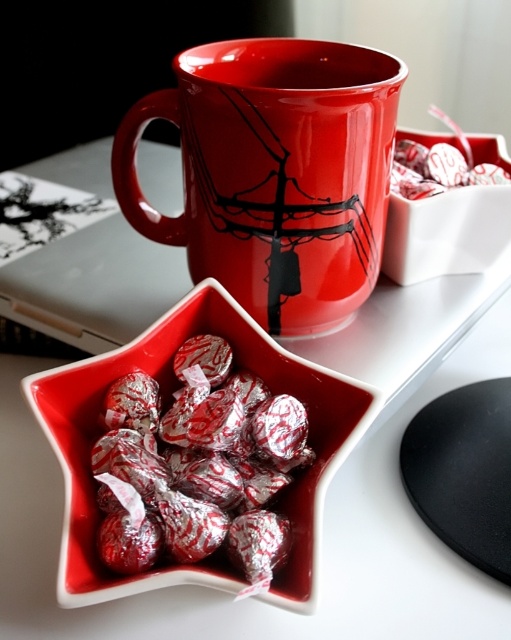
Question: Which object is the farthest from the silver foil wrapped heart at center?

Choices:
 (A) silver foil heart at center
 (B) glossy ceramic mug at upper center

Answer: (A)

Question: Can you confirm if silver foil wrapped heart at center is wider than silver foil heart at center?

Choices:
 (A) no
 (B) yes

Answer: (B)

Question: Which object is the farthest from the silver foil heart at center?

Choices:
 (A) silver foil wrapped heart at center
 (B) glossy ceramic mug at upper center

Answer: (A)

Question: Which point is farther from the camera taking this photo?

Choices:
 (A) (220, 124)
 (B) (483, 168)

Answer: (B)

Question: Can you confirm if silver foil wrapped heart at center is thinner than silver foil heart at center?

Choices:
 (A) no
 (B) yes

Answer: (A)

Question: Is glossy ceramic mug at upper center closer to the viewer compared to silver foil wrapped heart at center?

Choices:
 (A) no
 (B) yes

Answer: (A)